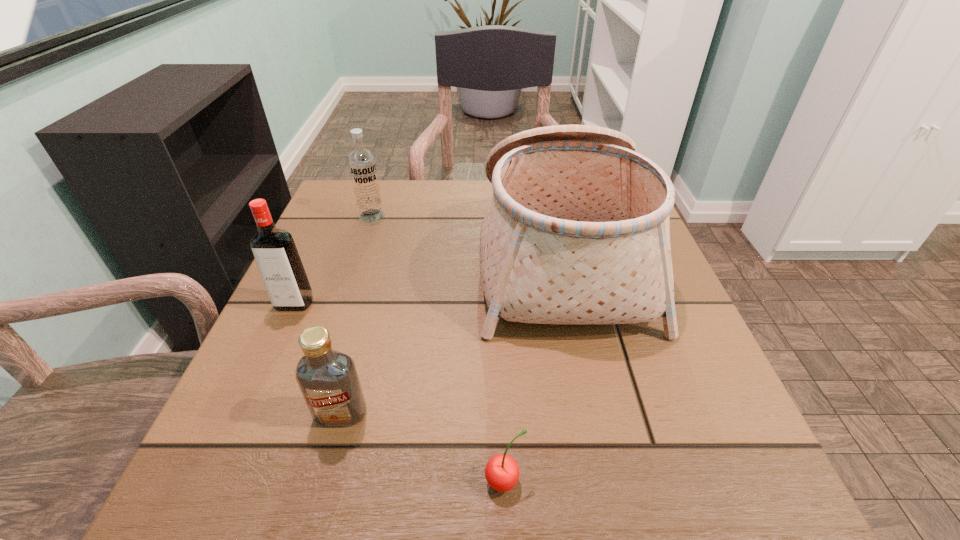
You are a GUI agent. You are given a task and a screenshot of the screen. Output one action in this format:
    pyautogui.click(x=<x>, y=<y>)
    Task: Click on the basket
    This screenshot has width=960, height=540.
    Given the screenshot: What is the action you would take?
    pyautogui.click(x=577, y=231)

Locate an element on the screen. Image resolution: width=960 pixels, height=540 pixels. the second nearest vodka is located at coordinates (280, 266).

This screenshot has height=540, width=960. I want to click on the leftmost vodka, so click(280, 266).

Find the location of a particular element. the farthest vodka is located at coordinates (362, 165).

I want to click on the nearest vodka, so click(x=328, y=379).

Identify the location of the second nearest object. The image size is (960, 540). (328, 379).

The height and width of the screenshot is (540, 960). In order to click on the shortest object in this screenshot , I will do `click(502, 473)`.

Locate an element on the screen. the nearest object is located at coordinates (502, 473).

The width and height of the screenshot is (960, 540). I want to click on vacant point located 0.230m with the lid open on the tallest object, so click(373, 256).

Identify the location of free point located with the lid open on the tallest object. Image resolution: width=960 pixels, height=540 pixels. (369, 256).